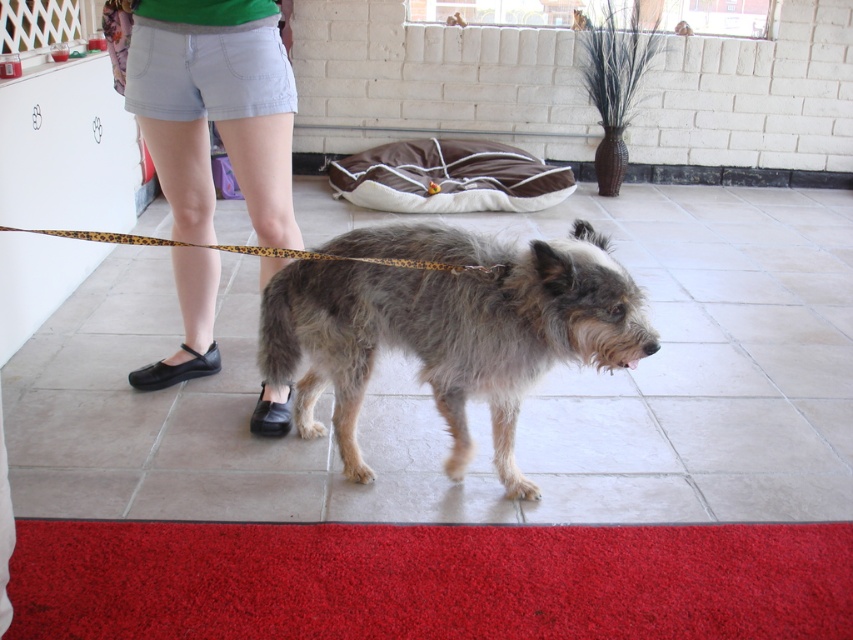
Can you confirm if light blue denim shorts at center is positioned to the right of leopard print leash at center?

In fact, light blue denim shorts at center is to the left of leopard print leash at center.

Which is in front, point (260, 81) or point (90, 234)?

Point (90, 234) is in front.

Identify the location of light blue denim shorts at center. This screenshot has height=640, width=853. (215, 108).

Image resolution: width=853 pixels, height=640 pixels. What do you see at coordinates (448, 326) in the screenshot?
I see `fuzzy fur dog at center` at bounding box center [448, 326].

Does fuzzy fur dog at center appear on the left side of leopard print leash at center?

No, fuzzy fur dog at center is not to the left of leopard print leash at center.

Locate an element on the screen. fuzzy fur dog at center is located at coordinates (448, 326).

Locate an element on the screen. The height and width of the screenshot is (640, 853). fuzzy fur dog at center is located at coordinates (448, 326).

Can you confirm if fuzzy fur dog at center is thinner than light blue denim shorts at center?

Incorrect, fuzzy fur dog at center's width is not less than light blue denim shorts at center's.

Is the position of fuzzy fur dog at center less distant than that of light blue denim shorts at center?

That is True.

You are a GUI agent. You are given a task and a screenshot of the screen. Output one action in this format:
    pyautogui.click(x=<x>, y=<y>)
    Task: Click on the fuzzy fur dog at center
    
    Given the screenshot: What is the action you would take?
    pyautogui.click(x=448, y=326)

This screenshot has width=853, height=640. I want to click on fuzzy fur dog at center, so click(x=448, y=326).